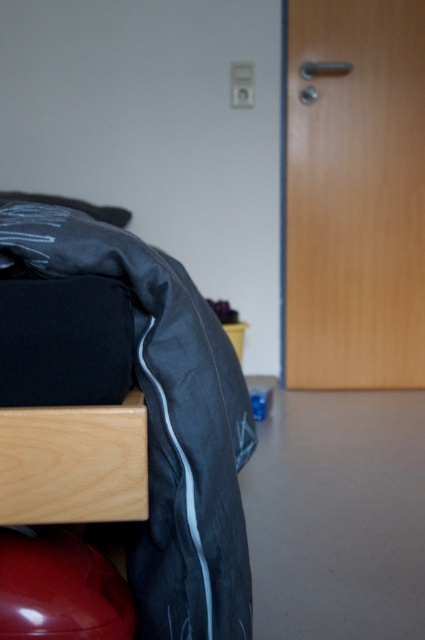
Does point (159, 400) come in front of point (78, 428)?

No, it is not.

Is matte black bed at lower left wider than light wood drawer at lower left?

Yes.

Locate an element on the screen. The image size is (425, 640). matte black bed at lower left is located at coordinates (167, 422).